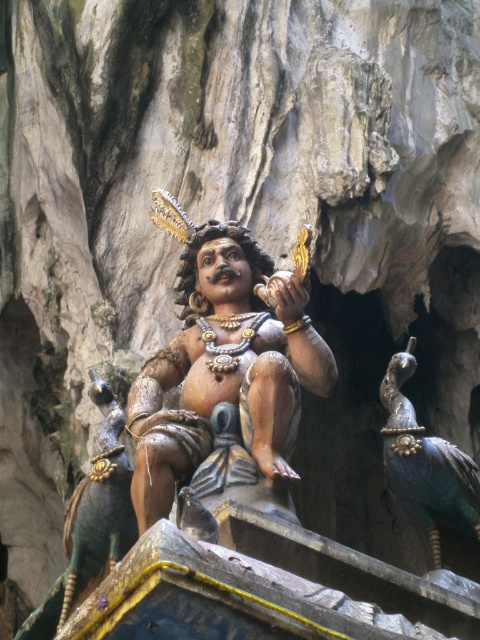
Question: Can you confirm if polished bronze statue at center is positioned to the left of shiny teal peacock at right?

Choices:
 (A) yes
 (B) no

Answer: (A)

Question: Which point appears farthest from the camera in this image?

Choices:
 (A) (93, 390)
 (B) (432, 451)
 (C) (168, 420)

Answer: (A)

Question: Estimate the real-world distances between objects in this image. Which object is farther from the shiny green peacock at center?

Choices:
 (A) polished bronze statue at center
 (B) shiny teal peacock at right

Answer: (B)

Question: Which of the following is the farthest from the observer?

Choices:
 (A) (472, 465)
 (B) (119, 531)
 (C) (184, 268)

Answer: (C)

Question: Is polished bronze statue at center smaller than shiny teal peacock at right?

Choices:
 (A) no
 (B) yes

Answer: (A)

Question: Does shiny teal peacock at right have a greater width compared to shiny green peacock at center?

Choices:
 (A) yes
 (B) no

Answer: (A)